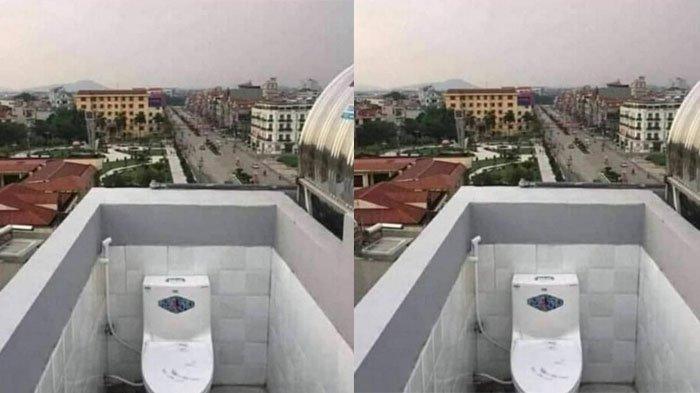
You are a GUI agent. You are given a task and a screenshot of the screen. Output one action in this format:
    pyautogui.click(x=<x>, y=<y>)
    Task: Click on the tiled walls
    The image size is (700, 393).
    Given the screenshot: What is the action you would take?
    pyautogui.click(x=244, y=319), pyautogui.click(x=309, y=331), pyautogui.click(x=84, y=346), pyautogui.click(x=441, y=350), pyautogui.click(x=598, y=298), pyautogui.click(x=662, y=333)